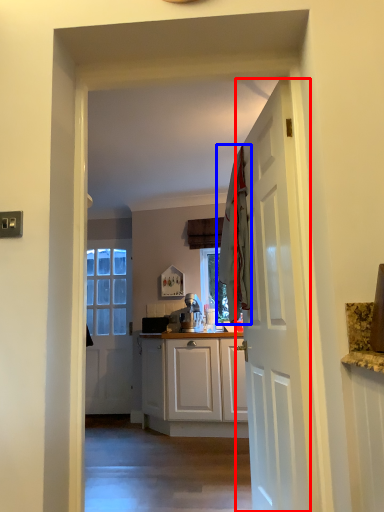
Question: Which point is closer to the camera, door (highlighted by a red box) or laundry (highlighted by a blue box)?

Choices:
 (A) door
 (B) laundry

Answer: (A)